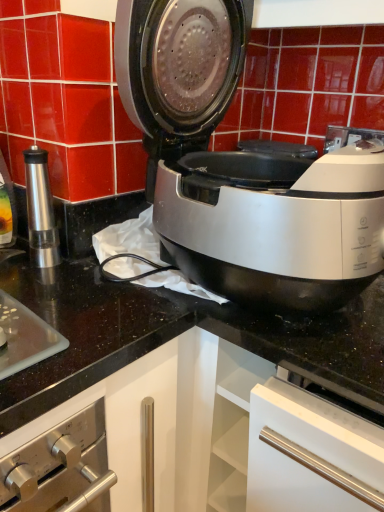
Question: From a real-world perspective, is satin silver air fryer at center located higher than metallic silver pepper grinder at left?

Choices:
 (A) yes
 (B) no

Answer: (A)

Question: From the image's perspective, would you say satin silver air fryer at center is positioned over metallic silver pepper grinder at left?

Choices:
 (A) no
 (B) yes

Answer: (B)

Question: Would you say satin silver air fryer at center contains metallic silver pepper grinder at left?

Choices:
 (A) yes
 (B) no

Answer: (B)

Question: Considering the relative sizes of satin silver air fryer at center and metallic silver pepper grinder at left in the image provided, is satin silver air fryer at center taller than metallic silver pepper grinder at left?

Choices:
 (A) no
 (B) yes

Answer: (B)

Question: Is satin silver air fryer at center thinner than metallic silver pepper grinder at left?

Choices:
 (A) yes
 (B) no

Answer: (B)

Question: Is satin silver air fryer at center at the left side of metallic silver pepper grinder at left?

Choices:
 (A) no
 (B) yes

Answer: (A)

Question: Can we say metallic silver pepper grinder at left lies outside satin silver air fryer at center?

Choices:
 (A) no
 (B) yes

Answer: (B)

Question: Considering the relative sizes of metallic silver pepper grinder at left and satin silver air fryer at center in the image provided, is metallic silver pepper grinder at left shorter than satin silver air fryer at center?

Choices:
 (A) no
 (B) yes

Answer: (B)

Question: Is the position of metallic silver pepper grinder at left more distant than that of satin silver air fryer at center?

Choices:
 (A) yes
 (B) no

Answer: (A)

Question: Could you tell me if metallic silver pepper grinder at left is turned towards satin silver air fryer at center?

Choices:
 (A) yes
 (B) no

Answer: (B)

Question: From a real-world perspective, is metallic silver pepper grinder at left beneath satin silver air fryer at center?

Choices:
 (A) yes
 (B) no

Answer: (A)

Question: Is metallic silver pepper grinder at left not near satin silver air fryer at center?

Choices:
 (A) no
 (B) yes

Answer: (A)

Question: Would you say satin silver air fryer at center is to the left or to the right of metallic silver pepper grinder at left in the picture?

Choices:
 (A) left
 (B) right

Answer: (B)